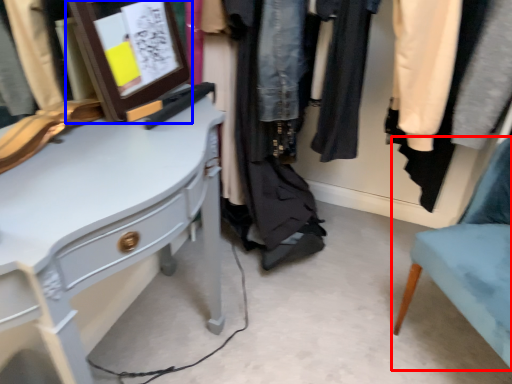
Question: Which of the following is the farthest to the observer, chair (highlighted by a red box) or picture frame (highlighted by a blue box)?

Choices:
 (A) chair
 (B) picture frame

Answer: (B)